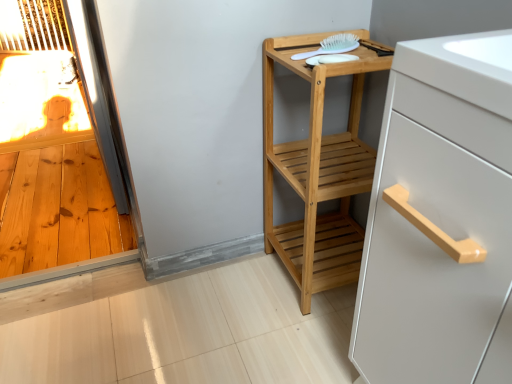
What do you see at coordinates (318, 173) in the screenshot? The height and width of the screenshot is (384, 512). I see `natural wood shelf at center` at bounding box center [318, 173].

What is the approximate height of natural wood shelf at center?

The height of natural wood shelf at center is 30.00 inches.

The width and height of the screenshot is (512, 384). I want to click on white matte cabinet handle at upper right, so click(438, 214).

At what (x,y) coordinates should I click in order to perform the action: click on brush that appears behind the white matte cabinet handle at upper right. Please return your answer as a coordinate pair (x, y). This screenshot has height=384, width=512. Looking at the image, I should click on (332, 46).

Is white plastic brush at upper right with white matte cabinet handle at upper right?

No, white plastic brush at upper right is not in contact with white matte cabinet handle at upper right.

Which object is thinner, white plastic brush at upper right or white matte cabinet handle at upper right?

Thinner between the two is white plastic brush at upper right.

Considering the relative sizes of white plastic brush at upper right and white matte cabinet handle at upper right in the image provided, is white plastic brush at upper right taller than white matte cabinet handle at upper right?

No.

Do you think natural wood shelf at center is within white plastic brush at upper right, or outside of it?

natural wood shelf at center is located beyond the bounds of white plastic brush at upper right.

From the image's perspective, is natural wood shelf at center on white plastic brush at upper right?

No, from the image's perspective, natural wood shelf at center is not above white plastic brush at upper right.

Considering the sizes of natural wood shelf at center and white plastic brush at upper right in the image, is natural wood shelf at center taller or shorter than white plastic brush at upper right?

Considering their sizes, natural wood shelf at center has more height than white plastic brush at upper right.

Which of these two, natural wood shelf at center or white plastic brush at upper right, is wider?

natural wood shelf at center is wider.

Is white matte cabinet handle at upper right taller or shorter than white plastic brush at upper right?

Considering their sizes, white matte cabinet handle at upper right has more height than white plastic brush at upper right.

In the scene shown: Would you consider white matte cabinet handle at upper right to be distant from white plastic brush at upper right?

They are positioned close to each other.

Looking at this image, can you confirm if white matte cabinet handle at upper right is smaller than white plastic brush at upper right?

No.

Measure the distance between white matte cabinet handle at upper right and white plastic brush at upper right.

24.76 inches.

Relative to white matte cabinet handle at upper right, is natural wood shelf at center in front or behind?

natural wood shelf at center is behind white matte cabinet handle at upper right.

Considering the relative sizes of natural wood shelf at center and white matte cabinet handle at upper right in the image provided, is natural wood shelf at center thinner than white matte cabinet handle at upper right?

Yes, natural wood shelf at center is thinner than white matte cabinet handle at upper right.

Looking at this image, is natural wood shelf at center in contact with white matte cabinet handle at upper right?

No, natural wood shelf at center is not with white matte cabinet handle at upper right.

Locate an element on the screen. furniture on the left of white matte cabinet handle at upper right is located at coordinates (318, 173).

Which is closer to the camera, (470,308) or (267,47)?

The point (470,308) is closer to the camera.

Visually, is white matte cabinet handle at upper right positioned to the left or to the right of natural wood shelf at center?

Based on their positions, white matte cabinet handle at upper right is located to the right of natural wood shelf at center.

Would you say white matte cabinet handle at upper right is inside or outside natural wood shelf at center?

white matte cabinet handle at upper right is not inside natural wood shelf at center, it's outside.

Between white matte cabinet handle at upper right and natural wood shelf at center, which one has more height?

white matte cabinet handle at upper right.

Can you see white plastic brush at upper right touching natural wood shelf at center?

No, white plastic brush at upper right is not with natural wood shelf at center.

Identify the location of furniture on the right of white plastic brush at upper right. (318, 173).

Is white plastic brush at upper right looking in the opposite direction of natural wood shelf at center?

That's right, white plastic brush at upper right is facing away from natural wood shelf at center.

Identify the location of cabinetry directly beneath the white plastic brush at upper right (from a real-world perspective). This screenshot has width=512, height=384. (438, 214).

The image size is (512, 384). Identify the location of furniture that appears on the right of white plastic brush at upper right. (318, 173).

When comparing their distances from white matte cabinet handle at upper right, does white plastic brush at upper right or natural wood shelf at center seem further?

white plastic brush at upper right is further to white matte cabinet handle at upper right.

Based on their spatial positions, is white matte cabinet handle at upper right or white plastic brush at upper right further from natural wood shelf at center?

Based on the image, white matte cabinet handle at upper right appears to be further to natural wood shelf at center.

Based on their spatial positions, is natural wood shelf at center or white matte cabinet handle at upper right closer to white plastic brush at upper right?

natural wood shelf at center is positioned closer to the anchor white plastic brush at upper right.

Which object lies nearer to the anchor point white matte cabinet handle at upper right, natural wood shelf at center or white plastic brush at upper right?

Among the two, natural wood shelf at center is located nearer to white matte cabinet handle at upper right.

When comparing their distances from natural wood shelf at center, does white plastic brush at upper right or white matte cabinet handle at upper right seem closer?

Among the two, white plastic brush at upper right is located nearer to natural wood shelf at center.

From the image, which object appears to be farther from white plastic brush at upper right, white matte cabinet handle at upper right or natural wood shelf at center?

Based on the image, white matte cabinet handle at upper right appears to be further to white plastic brush at upper right.

Identify the location of furniture positioned between white matte cabinet handle at upper right and white plastic brush at upper right from near to far. This screenshot has width=512, height=384. (318, 173).